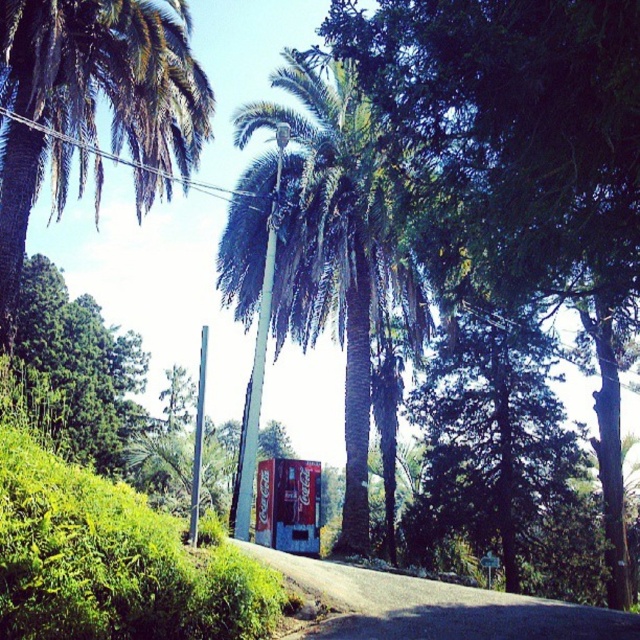
Question: Is green leafy palm tree at center positioned behind green leafy palm tree at upper left?

Choices:
 (A) yes
 (B) no

Answer: (B)

Question: Is green leafy palm tree at center smaller than green leafy palm tree at upper left?

Choices:
 (A) no
 (B) yes

Answer: (A)

Question: Can you confirm if green leafy palm tree at center is positioned to the left of green leafy palm tree at upper left?

Choices:
 (A) yes
 (B) no

Answer: (B)

Question: Which of the following is the farthest from the observer?

Choices:
 (A) green leafy palm tree at upper left
 (B) green leafy palm tree at center

Answer: (A)

Question: Which object appears closest to the camera in this image?

Choices:
 (A) green leafy palm tree at center
 (B) green leafy palm tree at upper left

Answer: (A)